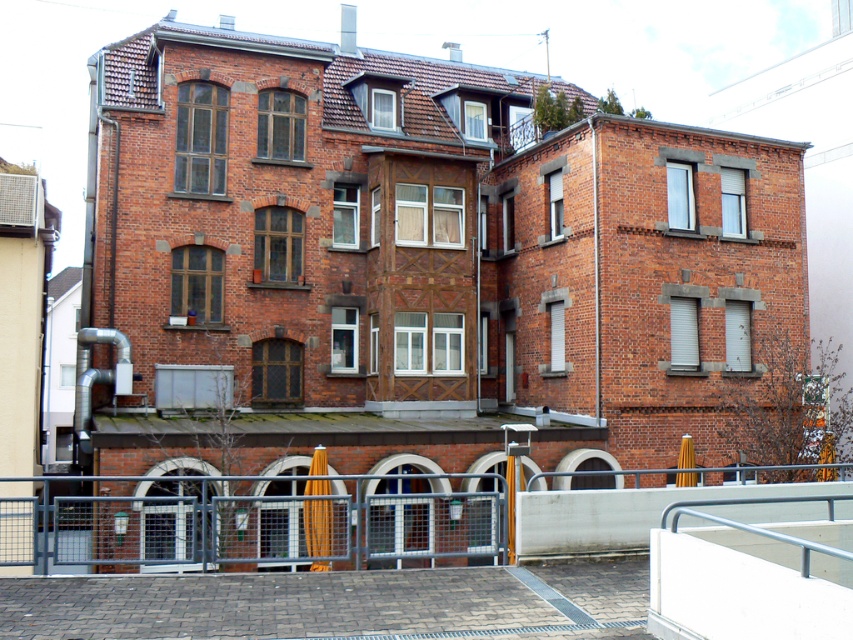
You are a delivery person approaching the building and need to determine which barrier is taller between the metal mesh fence at lower center and the silver metallic rail at lower right. Based on the scene, which one is taller?

The metal mesh fence at lower center is taller than the silver metallic rail at lower right.

You are standing in front of the building and want to take a photo of the metal mesh fence at lower center. According to the coordinates provided, where should you aim your camera to capture the fence in the center of the photo?

The metal mesh fence at lower center is located at coordinates point (245,522), so you should aim your camera at that point to center the fence in your photo.